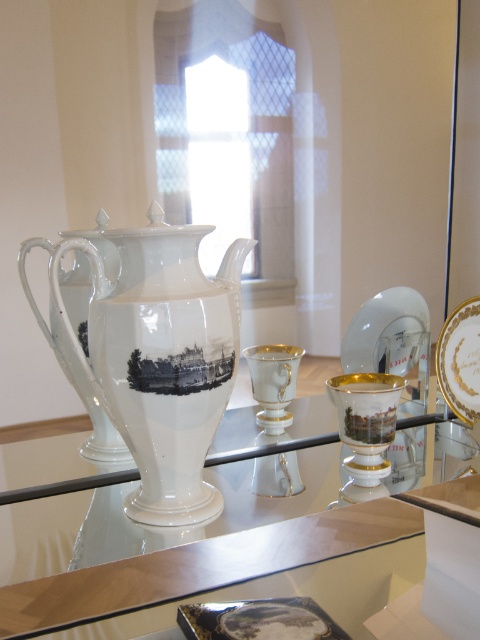
Does point (182, 356) come closer to viewer compared to point (460, 324)?

Yes, it is.

Is white porcelain teapot at center wider than gold-trimmed porcelain plate at right?

Indeed, white porcelain teapot at center has a greater width compared to gold-trimmed porcelain plate at right.

In order to click on white porcelain teapot at center in this screenshot , I will do `click(160, 356)`.

You are a GUI agent. You are given a task and a screenshot of the screen. Output one action in this format:
    pyautogui.click(x=<x>, y=<y>)
    Task: Click on the white porcelain teapot at center
    
    Given the screenshot: What is the action you would take?
    pyautogui.click(x=160, y=356)

At what (x,y) coordinates should I click in order to perform the action: click on transparent glass table at center. Please return your answer as a coordinate pair (x, y). Image resolution: width=480 pixels, height=640 pixels. Looking at the image, I should click on (223, 561).

Which of these two, transparent glass table at center or gold-trimmed porcelain plate at right, stands taller?

transparent glass table at center is taller.

Measure the distance between transparent glass table at center and camera.

A distance of 54.74 centimeters exists between transparent glass table at center and camera.

This screenshot has height=640, width=480. In order to click on transparent glass table at center in this screenshot , I will do `click(223, 561)`.

How far apart are transparent glass table at center and transparent glass saucer at right?

transparent glass table at center and transparent glass saucer at right are 14.66 inches apart from each other.

Does transparent glass table at center appear on the left side of transparent glass saucer at right?

Correct, you'll find transparent glass table at center to the left of transparent glass saucer at right.

Between point (167, 552) and point (374, 342), which one is positioned in front?

Point (167, 552) is in front.

The image size is (480, 640). I want to click on transparent glass table at center, so click(223, 561).